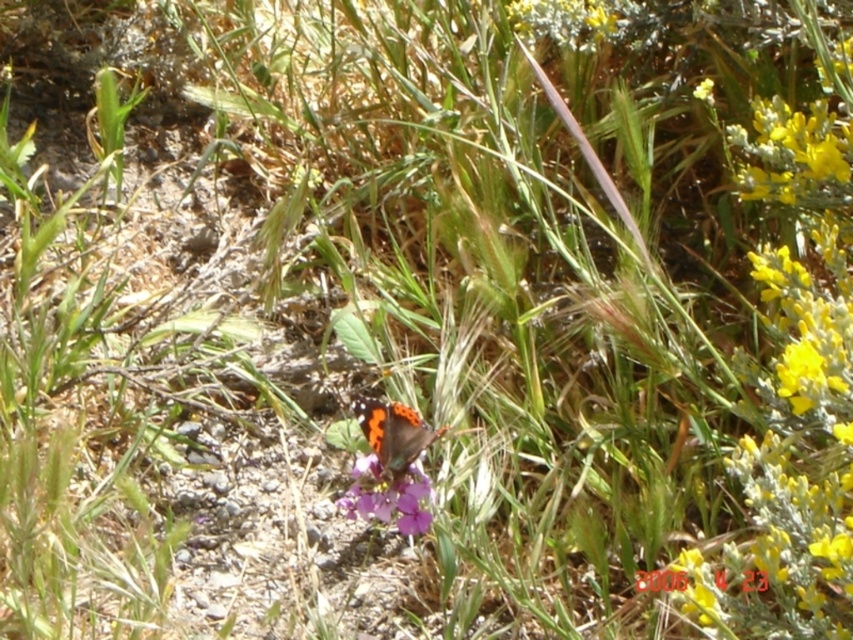
What object is located at the coordinates point (387,497) in the scene?

The point (387,497) corresponds to the purple matte flower at center.

You are a botanist studying the positioning of flowers in this outdoor scene. You observe the point labeled as point (795, 372). Which flower does this point correspond to?

The point (795, 372) corresponds to the yellow matte flower at upper right.

You are a photographer standing 3 feet away from the butterfly. You want to capture a close shot of the yellow matte flower at upper right without moving the camera. Can you include the butterfly in the same frame?

The yellow matte flower at upper right is 4.00 feet away from the viewer, while you are already 3 feet away from the butterfly. Since the flower is farther away than the butterfly, you can include both in the same frame by adjusting the camera angle or zoom to encompass both subjects.